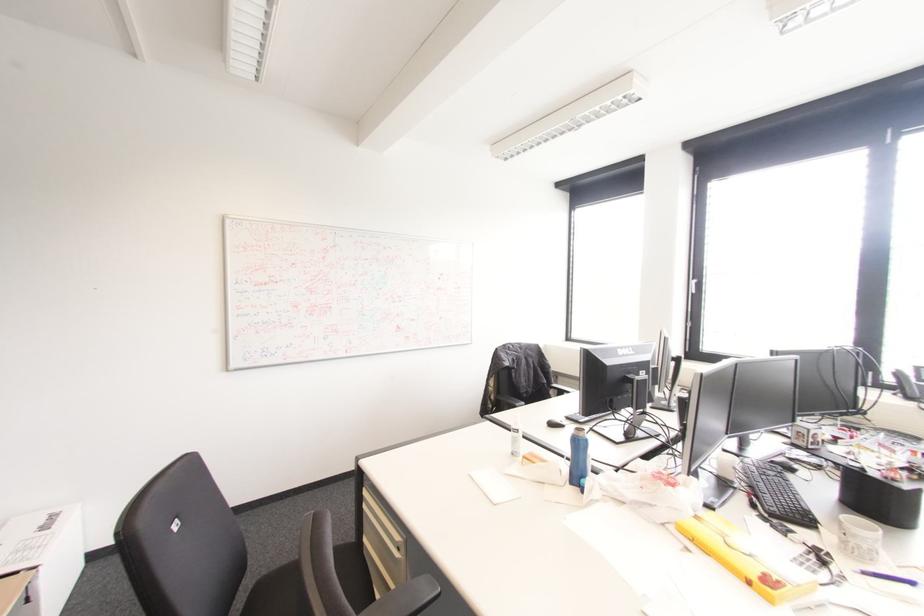
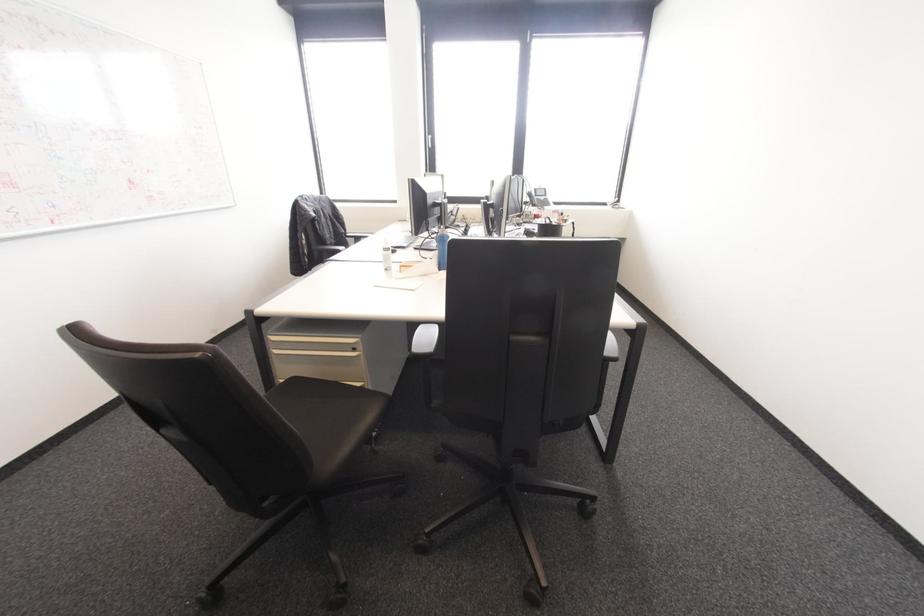
Find the pixel in the second image that matches pixel 397 548 in the first image.

(354, 349)